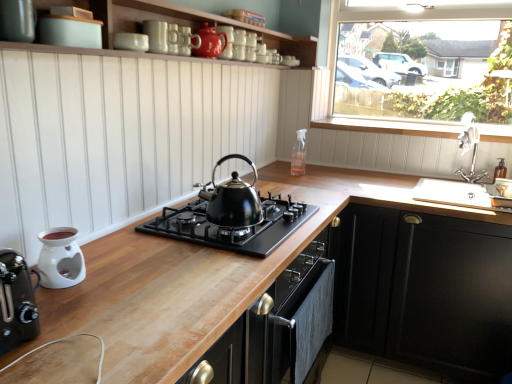
You are a GUI agent. You are given a task and a screenshot of the screen. Output one action in this format:
    pyautogui.click(x=<x>, y=<y>)
    Task: Click on the free location to the right of white glossy oil burner at lower left, which is the 4th appliance in top-to-bottom order
    
    Given the screenshot: What is the action you would take?
    click(x=134, y=282)